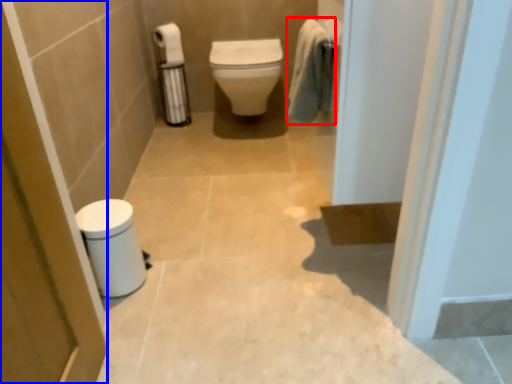
Question: Among these objects, which one is nearest to the camera, bath towel (highlighted by a red box) or screen door (highlighted by a blue box)?

Choices:
 (A) bath towel
 (B) screen door

Answer: (B)